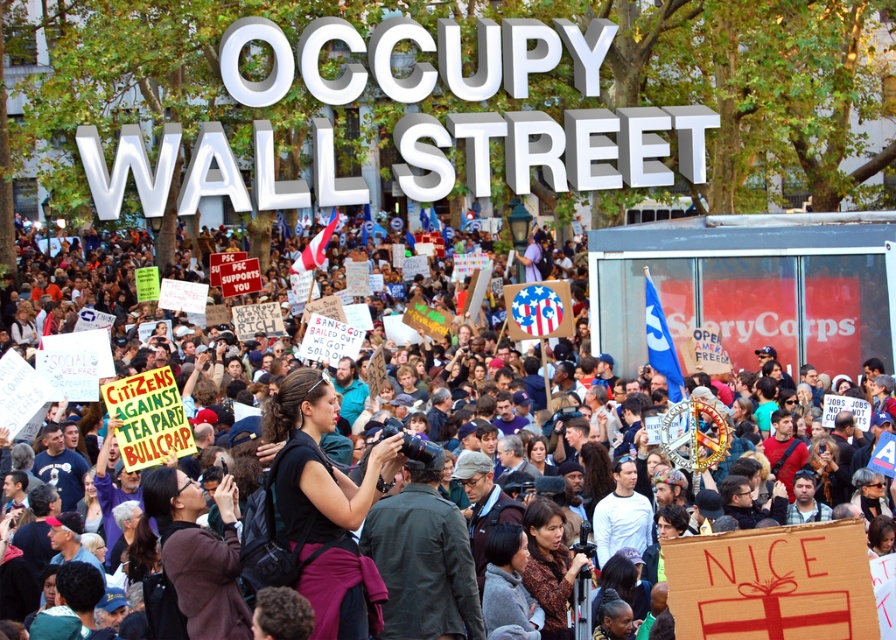
Question: Observing the image, what is the correct spatial positioning of black fabric camera at center in reference to brown leather jacket at center?

Choices:
 (A) above
 (B) below

Answer: (A)

Question: Which of the following is the closest to the observer?

Choices:
 (A) (151, 480)
 (B) (676, 228)

Answer: (A)

Question: Is white cardboard signs at center closer to camera compared to black fabric camera at center?

Choices:
 (A) yes
 (B) no

Answer: (B)

Question: Which of these objects is positioned closest to the brown patterned dress at lower center?

Choices:
 (A) black fabric camera at center
 (B) brown leather jacket at center

Answer: (A)

Question: Can you confirm if white cardboard signs at center is wider than brown patterned dress at lower center?

Choices:
 (A) no
 (B) yes

Answer: (B)

Question: Which point is farther from the camera taking this photo?

Choices:
 (A) (556, 604)
 (B) (326, 522)
 (C) (83, 275)

Answer: (C)